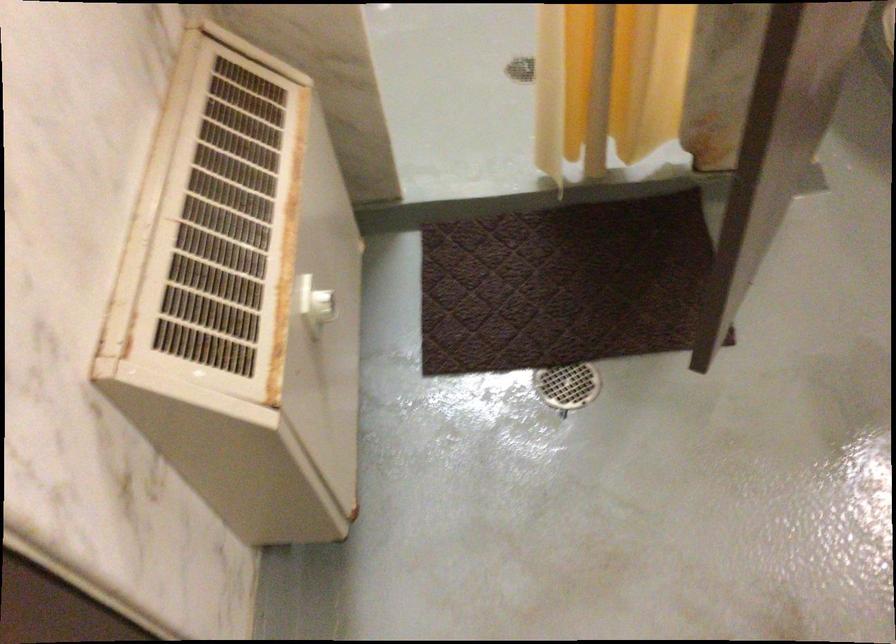
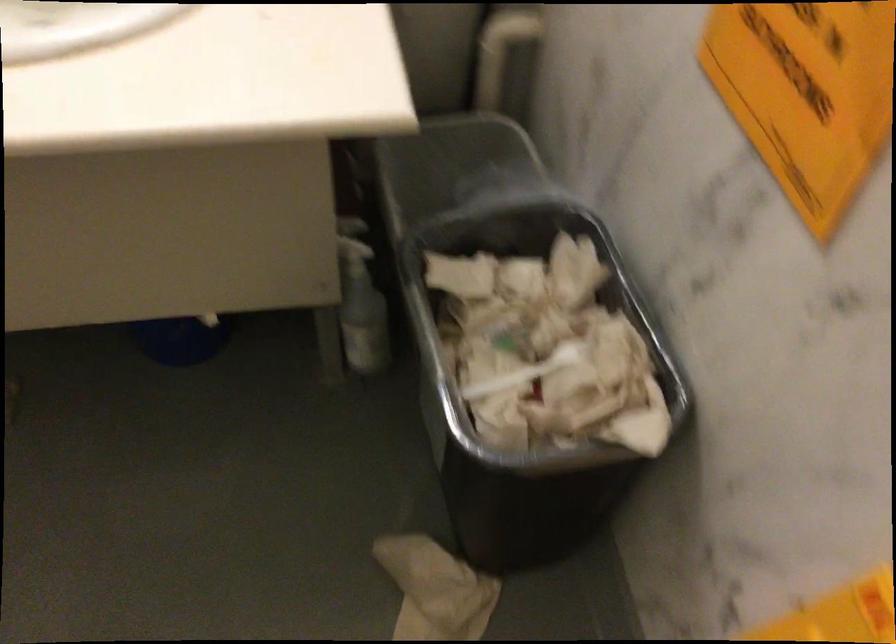
The images are taken continuously from a first-person perspective. In which direction is your viewpoint rotating?

The rotation direction of the camera is right-down.